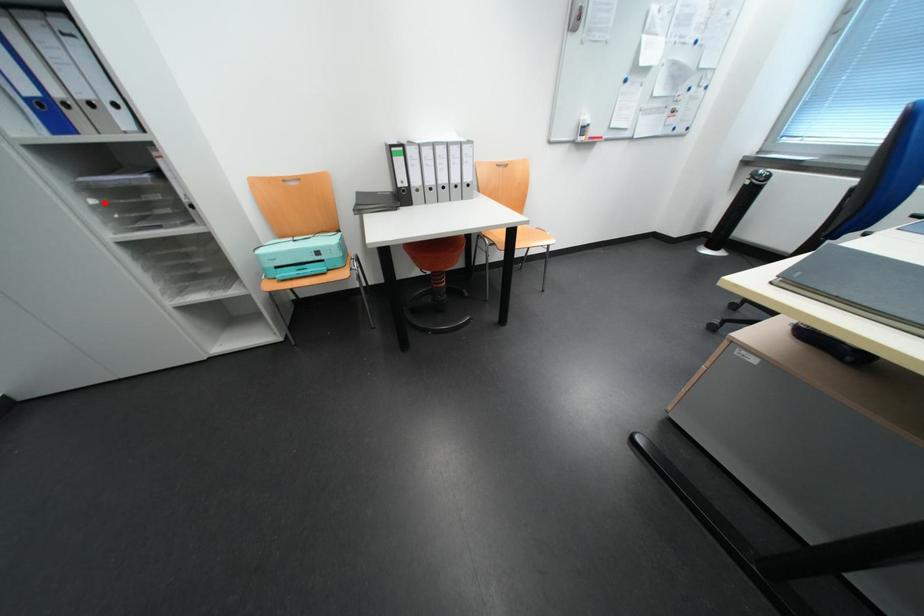
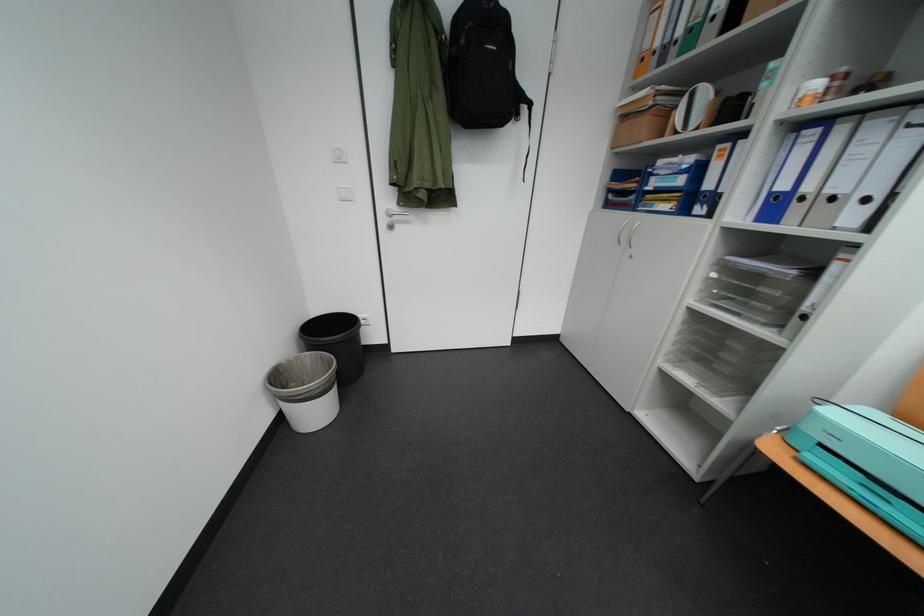
In the second image, find the point that corresponds to the highlighted location in the first image.

(724, 277)